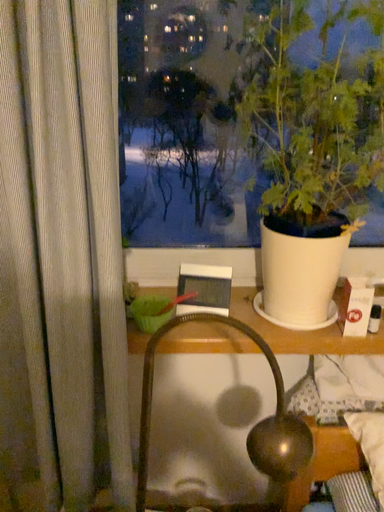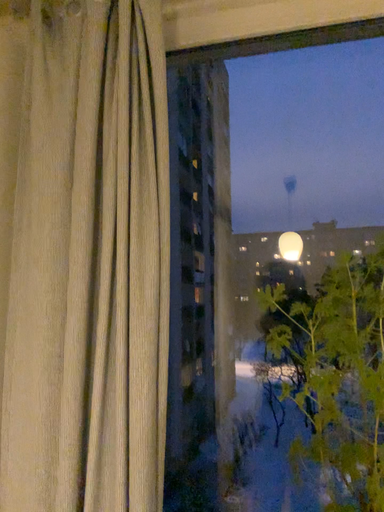
Question: Which way did the camera rotate in the video?

Choices:
 (A) rotated downward
 (B) rotated upward

Answer: (B)